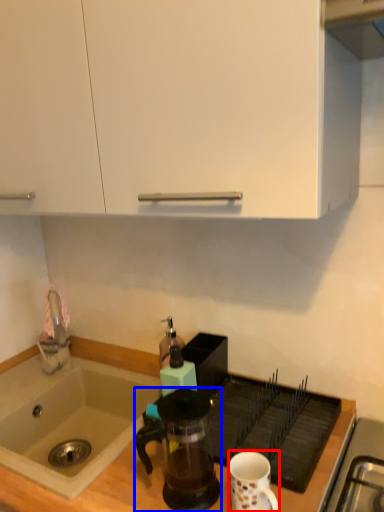
Question: Which point is closer to the camera, coffee cup (highlighted by a red box) or coffee maker (highlighted by a blue box)?

Choices:
 (A) coffee cup
 (B) coffee maker

Answer: (A)